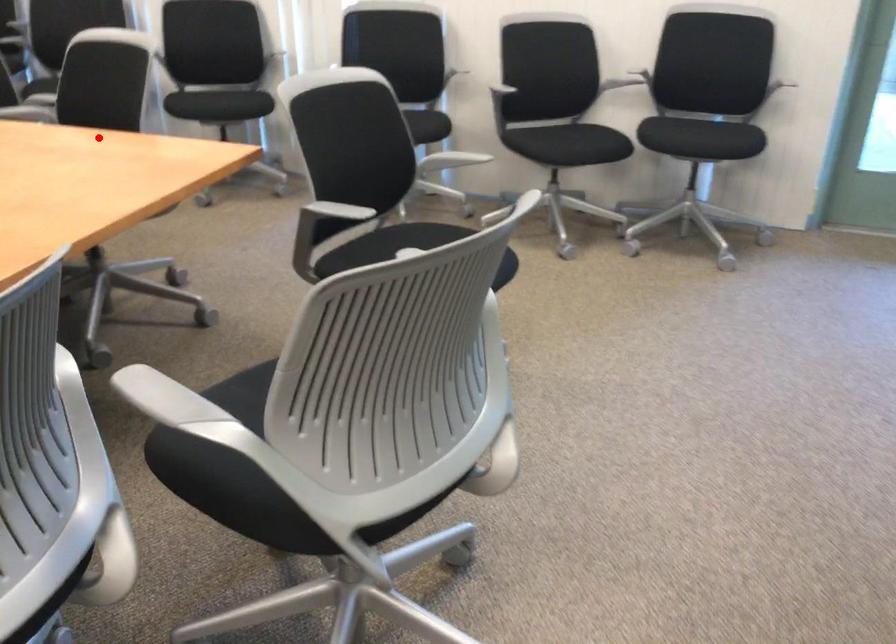
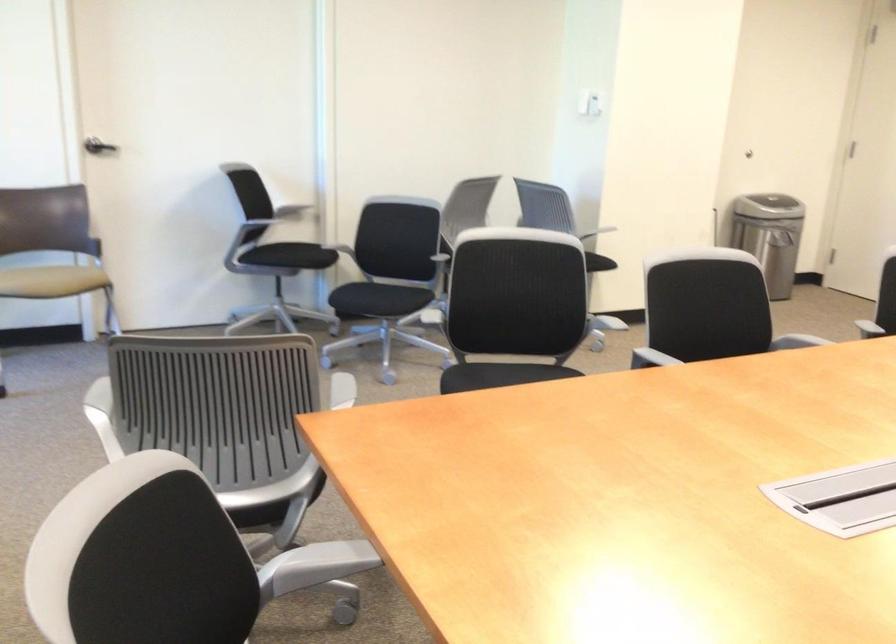
Question: I am providing you with two images of the same scene from different viewpoints. Image1 has a red point marked. In image2, the corresponding 3D location appears at what relative position? Reply with the corresponding letter.

Choices:
 (A) Closer
 (B) Farther

Answer: (A)